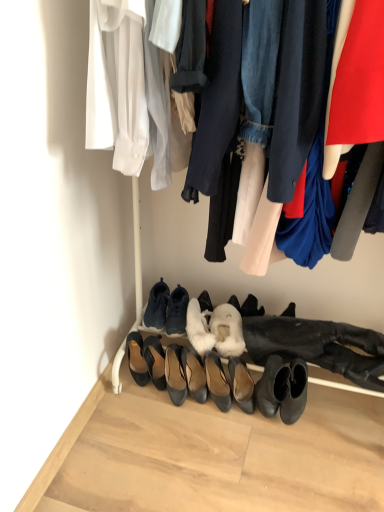
What do you see at coordinates (227, 330) in the screenshot? I see `white fluffy slipper at center, positioned as the second shoe in left-to-right order` at bounding box center [227, 330].

What do you see at coordinates (177, 311) in the screenshot? Image resolution: width=384 pixels, height=512 pixels. I see `matte black sneakers at center, which appears as the 4th footwear when viewed from the right` at bounding box center [177, 311].

What is the approximate height of matte black heels at center, which appears as the 2th footwear when viewed from the right?

It is 9.47 inches.

In order to face white fur boot at center, which ranks as the second shoe in right-to-left order, should I rotate leftwards or rightwards?

It's best to rotate right around 1.251 degrees.

Locate an element on the screen. This screenshot has width=384, height=512. brown leather heels at lower center, positioned as the 8th footwear in left-to-right order is located at coordinates point(241,384).

The width and height of the screenshot is (384, 512). Find the location of `shiny black heels at center, the 6th footwear viewed from the left`. shiny black heels at center, the 6th footwear viewed from the left is located at coordinates (195, 374).

What do you see at coordinates (195, 374) in the screenshot?
I see `shiny black heels at center, the 6th footwear viewed from the left` at bounding box center [195, 374].

What are the coordinates of `white fluffy slipper at center, which is the first shoe from right to left` in the screenshot? It's located at click(227, 330).

From the picture: Are white fur boot at center, which appears as the first shoe when viewed from the left, and matte black sneakers at center, which is the 5th footwear in left-to-right order, located far from each other?

Actually, white fur boot at center, which appears as the first shoe when viewed from the left, and matte black sneakers at center, which is the 5th footwear in left-to-right order, are a little close together.

Based on their sizes in the image, would you say white fur boot at center, which ranks as the second shoe in right-to-left order, is bigger or smaller than matte black sneakers at center, which is the 5th footwear in left-to-right order?

Considering their sizes, white fur boot at center, which ranks as the second shoe in right-to-left order, takes up more space than matte black sneakers at center, which is the 5th footwear in left-to-right order.

From the image's perspective, relative to matte black sneakers at center, which appears as the 4th footwear when viewed from the right, is white fur boot at center, which ranks as the second shoe in right-to-left order, above or below?

From the image's perspective, white fur boot at center, which ranks as the second shoe in right-to-left order, appears below matte black sneakers at center, which appears as the 4th footwear when viewed from the right.

Looking at this image, which of these two, white fluffy slipper at center, which is the first shoe from right to left, or matte black heels at center, which is counted as the seventh footwear, starting from the left, is smaller?

With smaller size is matte black heels at center, which is counted as the seventh footwear, starting from the left.

Could you tell me if white fluffy slipper at center, which is the first shoe from right to left, is facing matte black heels at center, which is counted as the seventh footwear, starting from the left?

Yes.

Looking at their sizes, would you say white fluffy slipper at center, which is the first shoe from right to left, is wider or thinner than matte black heels at center, which is counted as the seventh footwear, starting from the left?

Considering their sizes, white fluffy slipper at center, which is the first shoe from right to left, looks broader than matte black heels at center, which is counted as the seventh footwear, starting from the left.

Locate an element on the screen. The width and height of the screenshot is (384, 512). the 1st shoe above when counting from the matte black heels at center, which appears as the 2th footwear when viewed from the right (from the image's perspective) is located at coordinates (227, 330).

Does dark gray suede sneakers at center, which is the 3th footwear in left-to-right order, come behind white fluffy slipper at center, which is the first shoe from right to left?

Yes, dark gray suede sneakers at center, which is the 3th footwear in left-to-right order, is further from the camera.

How many degrees apart are the facing directions of dark gray suede sneakers at center, which is the 3th footwear in left-to-right order, and white fluffy slipper at center, which is the first shoe from right to left?

dark gray suede sneakers at center, which is the 3th footwear in left-to-right order, and white fluffy slipper at center, which is the first shoe from right to left, are facing 10.6 degrees away from each other.

Considering the relative sizes of dark gray suede sneakers at center, which is the 3th footwear in left-to-right order, and white fluffy slipper at center, positioned as the second shoe in left-to-right order, in the image provided, is dark gray suede sneakers at center, which is the 3th footwear in left-to-right order, wider than white fluffy slipper at center, positioned as the second shoe in left-to-right order,?

No, dark gray suede sneakers at center, which is the 3th footwear in left-to-right order, is not wider than white fluffy slipper at center, positioned as the second shoe in left-to-right order.

From the image's perspective, which object appears higher, black leather heels at lower center, arranged as the eighth footwear when viewed from the right, or dark gray suede sneakers at center, which is the 3th footwear in left-to-right order?

dark gray suede sneakers at center, which is the 3th footwear in left-to-right order, is shown above in the image.

Is black leather heels at lower center, arranged as the eighth footwear when viewed from the right, positioned beyond the bounds of dark gray suede sneakers at center, which is the 3th footwear in left-to-right order?

Yes, black leather heels at lower center, arranged as the eighth footwear when viewed from the right, is outside of dark gray suede sneakers at center, which is the 3th footwear in left-to-right order.

Find the location of a particular element. the 2nd footwear in front when counting from the dark gray suede sneakers at center, which is the 3th footwear in left-to-right order is located at coordinates (137, 358).

Starting from the matte black sneakers at center, which is the 5th footwear in left-to-right order, which footwear is the 1st one to the left? Please provide its 2D coordinates.

[(175, 375)]

From a real-world perspective, does matte black sneakers at center, which appears as the 4th footwear when viewed from the right, sit lower than black leather heels at center, the 4th footwear viewed from the left?

No.

Looking at this image, could you measure the distance between matte black sneakers at center, which is the 5th footwear in left-to-right order, and black leather heels at center, the fifth footwear in the right-to-left sequence?

matte black sneakers at center, which is the 5th footwear in left-to-right order, and black leather heels at center, the fifth footwear in the right-to-left sequence, are 5.85 inches apart.

Looking at this image, is matte black sneakers at center, which appears as the 4th footwear when viewed from the right, surrounding black leather heels at center, the 4th footwear viewed from the left?

No.

Considering the sizes of white fur boot at center, which ranks as the second shoe in right-to-left order, and black leather heels at lower center, placed as the 1th footwear when sorted from left to right, in the image, is white fur boot at center, which ranks as the second shoe in right-to-left order, taller or shorter than black leather heels at lower center, placed as the 1th footwear when sorted from left to right,?

white fur boot at center, which ranks as the second shoe in right-to-left order, is shorter than black leather heels at lower center, placed as the 1th footwear when sorted from left to right.

From a real-world perspective, is white fur boot at center, which appears as the first shoe when viewed from the left, under black leather heels at lower center, placed as the 1th footwear when sorted from left to right?

No, from a real-world perspective, white fur boot at center, which appears as the first shoe when viewed from the left, is not below black leather heels at lower center, placed as the 1th footwear when sorted from left to right.

Is white fur boot at center, which ranks as the second shoe in right-to-left order, aimed at black leather heels at lower center, placed as the 1th footwear when sorted from left to right?

No, white fur boot at center, which ranks as the second shoe in right-to-left order, is not facing towards black leather heels at lower center, placed as the 1th footwear when sorted from left to right.

Which of these two, white fur boot at center, which ranks as the second shoe in right-to-left order, or black leather heels at lower center, placed as the 1th footwear when sorted from left to right, is smaller?

With smaller size is black leather heels at lower center, placed as the 1th footwear when sorted from left to right.

Is white fur boot at center, which ranks as the second shoe in right-to-left order, closer to camera compared to dark gray suede sneakers at center, the 6th footwear from the right?

Yes, white fur boot at center, which ranks as the second shoe in right-to-left order, is in front of dark gray suede sneakers at center, the 6th footwear from the right.

Is there a large distance between white fur boot at center, which appears as the first shoe when viewed from the left, and dark gray suede sneakers at center, the 6th footwear from the right?

No, white fur boot at center, which appears as the first shoe when viewed from the left, is in close proximity to dark gray suede sneakers at center, the 6th footwear from the right.

How different are the orientations of white fur boot at center, which ranks as the second shoe in right-to-left order, and dark gray suede sneakers at center, which is the 3th footwear in left-to-right order, in degrees?

They differ by 17.4 degrees in their facing directions.

Considering the points (191, 312) and (161, 321), which point is behind, point (191, 312) or point (161, 321)?

The point (161, 321) is farther.

Locate an element on the screen. footwear that is the 2nd one when counting leftward from the white fur boot at center, which ranks as the second shoe in right-to-left order is located at coordinates (177, 311).

Starting from the white fluffy slipper at center, which is the first shoe from right to left, which footwear is the 3rd one in front? Please provide its 2D coordinates.

[(217, 382)]

From the picture: Considering their positions, is white fur boot at center, which ranks as the second shoe in right-to-left order, positioned further to matte black sneakers at center, which appears as the 4th footwear when viewed from the right, than shiny black heels at center, the 6th footwear viewed from the left?

shiny black heels at center, the 6th footwear viewed from the left, is positioned further to the anchor matte black sneakers at center, which appears as the 4th footwear when viewed from the right.

From the picture: Which object lies nearer to the anchor point matte black heels at center, which appears as the 2th footwear when viewed from the right, matte black sneakers at center, which is the 5th footwear in left-to-right order, or black leather heels at center, the seventh footwear when ordered from right to left?

black leather heels at center, the seventh footwear when ordered from right to left.

Estimate the real-world distances between objects in this image. Which object is further from matte black sneakers at center, which is the 5th footwear in left-to-right order, black leather heels at lower center, placed as the 1th footwear when sorted from left to right, or shiny black heels at center, marked as the 3th footwear in a right-to-left arrangement?

black leather heels at lower center, placed as the 1th footwear when sorted from left to right, is further to matte black sneakers at center, which is the 5th footwear in left-to-right order.

When comparing their distances from black leather heels at center, the 4th footwear viewed from the left, does shiny black heels at center, the 6th footwear viewed from the left, or dark gray suede sneakers at center, the 6th footwear from the right, seem further?

dark gray suede sneakers at center, the 6th footwear from the right, lies further to black leather heels at center, the 4th footwear viewed from the left, than the other object.

Considering their positions, is matte black sneakers at center, which is the 5th footwear in left-to-right order, positioned further to black leather heels at center, the 4th footwear viewed from the left, than brown leather heels at lower center, positioned as the 8th footwear in left-to-right order?

Among the two, brown leather heels at lower center, positioned as the 8th footwear in left-to-right order, is located further to black leather heels at center, the 4th footwear viewed from the left.

Which object lies nearer to the anchor point shiny black heels at center, the 6th footwear viewed from the left, black leather heels at center, the fifth footwear in the right-to-left sequence, or dark gray suede sneakers at center, the 6th footwear from the right?

Based on the image, black leather heels at center, the fifth footwear in the right-to-left sequence, appears to be nearer to shiny black heels at center, the 6th footwear viewed from the left.

From the image, which object appears to be farther from black leather heels at center, the fifth footwear in the right-to-left sequence, matte black sneakers at center, which is the 5th footwear in left-to-right order, or matte black heels at center, which is counted as the seventh footwear, starting from the left?

matte black sneakers at center, which is the 5th footwear in left-to-right order.

In the scene shown: Based on their spatial positions, is black leather heels at center, the 4th footwear viewed from the left, or matte black sneakers at center, which is the 5th footwear in left-to-right order, further from white fur boot at center, which appears as the first shoe when viewed from the left?

black leather heels at center, the 4th footwear viewed from the left.

The height and width of the screenshot is (512, 384). I want to click on footwear situated between shiny black heels at center, marked as the 3th footwear in a right-to-left arrangement, and brown leather heels at lower center, positioned as the 8th footwear in left-to-right order, from left to right, so pos(217,382).

Where is `shoe between matte black sneakers at center, which appears as the 4th footwear when viewed from the right, and white fluffy slipper at center, positioned as the second shoe in left-to-right order`? shoe between matte black sneakers at center, which appears as the 4th footwear when viewed from the right, and white fluffy slipper at center, positioned as the second shoe in left-to-right order is located at coordinates (199, 328).

Locate an element on the screen. shoe between black leather heels at lower center, arranged as the eighth footwear when viewed from the right, and matte black heels at center, which appears as the 2th footwear when viewed from the right, in the horizontal direction is located at coordinates (199, 328).

The width and height of the screenshot is (384, 512). Identify the location of shoe between white fur boot at center, which ranks as the second shoe in right-to-left order, and brown leather heels at lower center, the first footwear positioned from the right, from top to bottom. (227, 330).